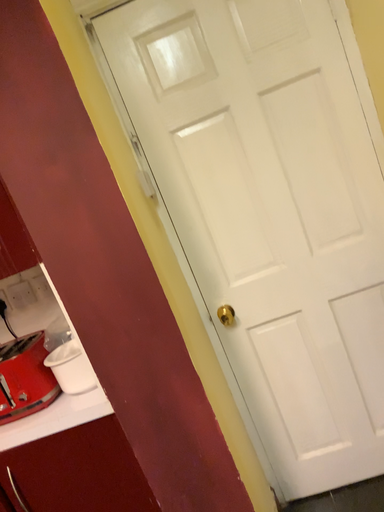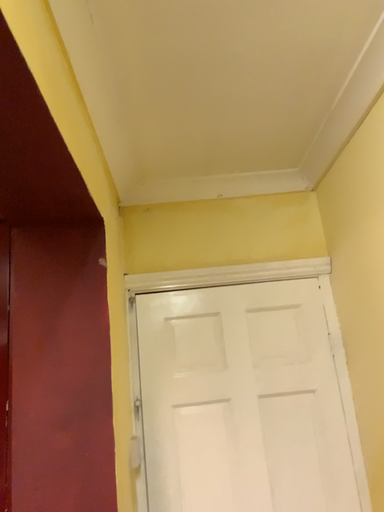
Question: How did the camera likely rotate when shooting the video?

Choices:
 (A) rotated upward
 (B) rotated downward

Answer: (A)